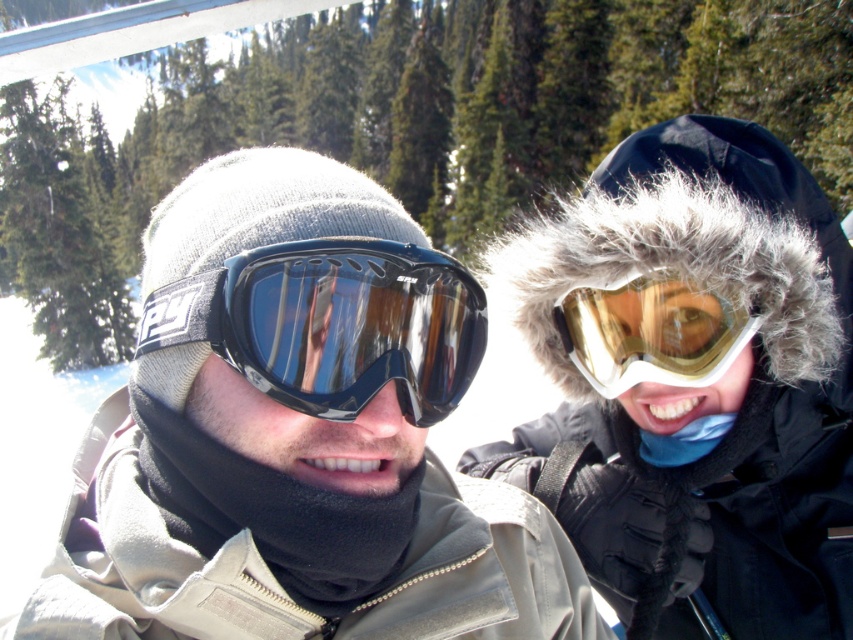
Is black glossy goggles at center shorter than gold reflective goggles at upper right?

Yes.

At what (x,y) coordinates should I click in order to perform the action: click on black glossy goggles at center. Please return your answer as a coordinate pair (x, y). The width and height of the screenshot is (853, 640). Looking at the image, I should click on (343, 324).

The height and width of the screenshot is (640, 853). I want to click on black glossy goggles at center, so click(343, 324).

Who is positioned more to the left, matte black goggles at center or gold reflective goggles at upper right?

matte black goggles at center

Is point (543, 540) farther from camera compared to point (694, 369)?

No, it is in front of (694, 369).

This screenshot has height=640, width=853. Identify the location of matte black goggles at center. (296, 436).

Between matte black goggles at center and black glossy goggles at center, which one is positioned lower?

Positioned lower is matte black goggles at center.

Between point (234, 310) and point (456, 273), which one is positioned behind?

The point (456, 273) is more distant.

Locate an element on the screen. matte black goggles at center is located at coordinates (296, 436).

Image resolution: width=853 pixels, height=640 pixels. I want to click on matte black goggles at center, so click(296, 436).